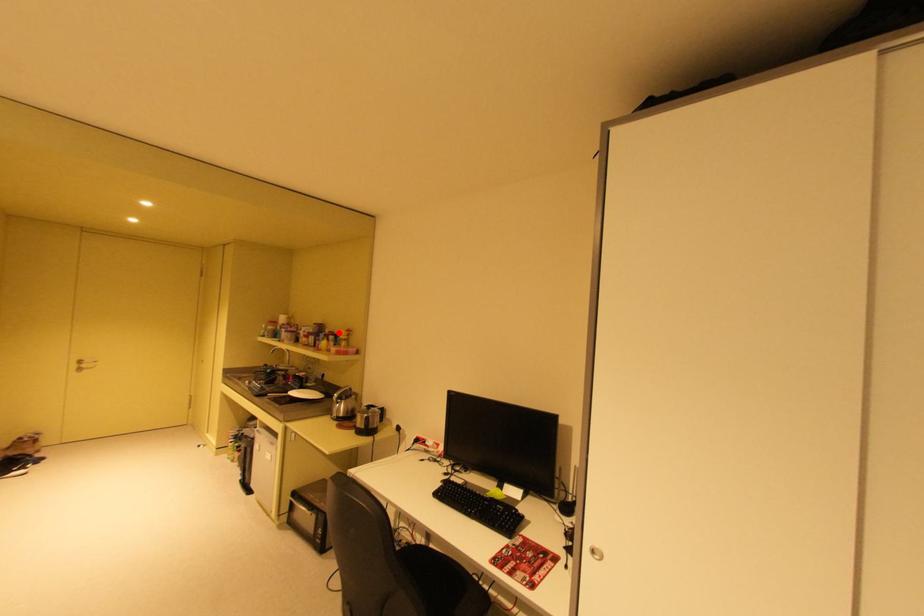
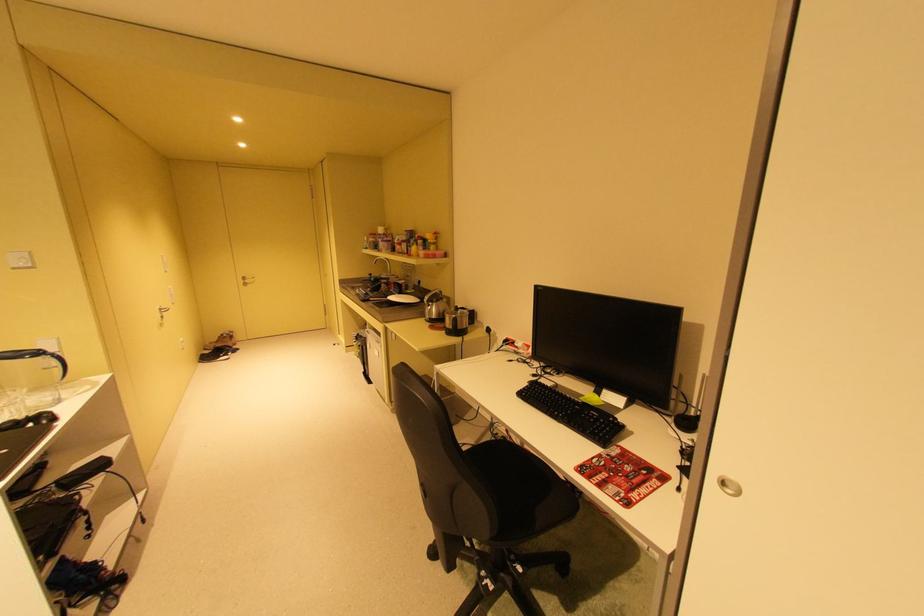
Question: A red point is marked in image1. In image2, is the corresponding 3D point closer to the camera or farther? Reply with the corresponding letter.

Choices:
 (A) The corresponding 3D point is closer.
 (B) The corresponding 3D point is farther.

Answer: (A)